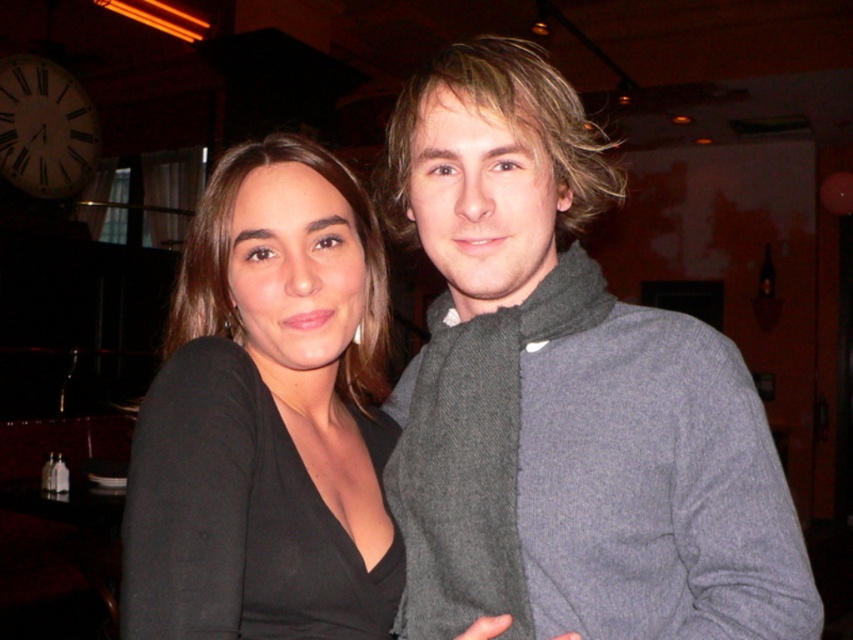
Question: Among these points, which one is nearest to the camera?

Choices:
 (A) (277, 458)
 (B) (21, 92)

Answer: (A)

Question: Which object is farther from the camera taking this photo?

Choices:
 (A) white wooden clock at upper left
 (B) black matte shirt at center

Answer: (A)

Question: Does black matte shirt at center have a greater width compared to white wooden clock at upper left?

Choices:
 (A) yes
 (B) no

Answer: (A)

Question: Can you confirm if black matte shirt at center is wider than white wooden clock at upper left?

Choices:
 (A) yes
 (B) no

Answer: (A)

Question: Can you confirm if black matte shirt at center is positioned above white wooden clock at upper left?

Choices:
 (A) yes
 (B) no

Answer: (B)